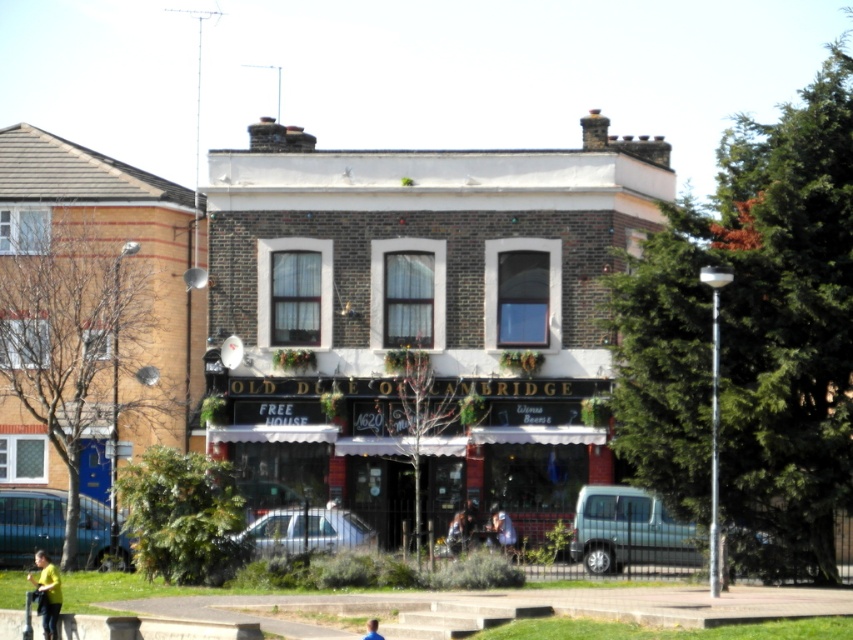
You are standing in front of the building and want to take a photo that includes both the point at coordinates point (x=502, y=512) and point (x=369, y=628). Which point should you focus on first to ensure both are in focus?

You should focus on point (x=502, y=512) first because it is closer to the camera than point (x=369, y=628). This ensures that both points will be in focus when taking the photo.